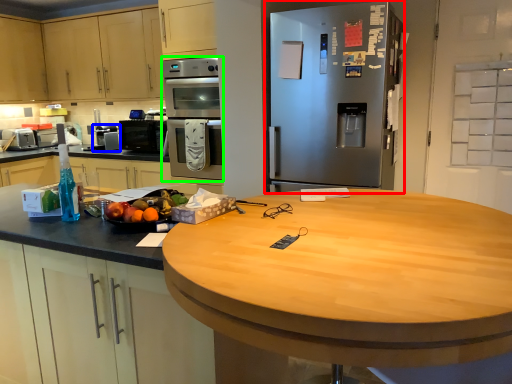
Question: Based on their relative distances, which object is nearer to refrigerator (highlighted by a red box)? Choose from appliance (highlighted by a blue box) and oven (highlighted by a green box).

Choices:
 (A) appliance
 (B) oven

Answer: (B)